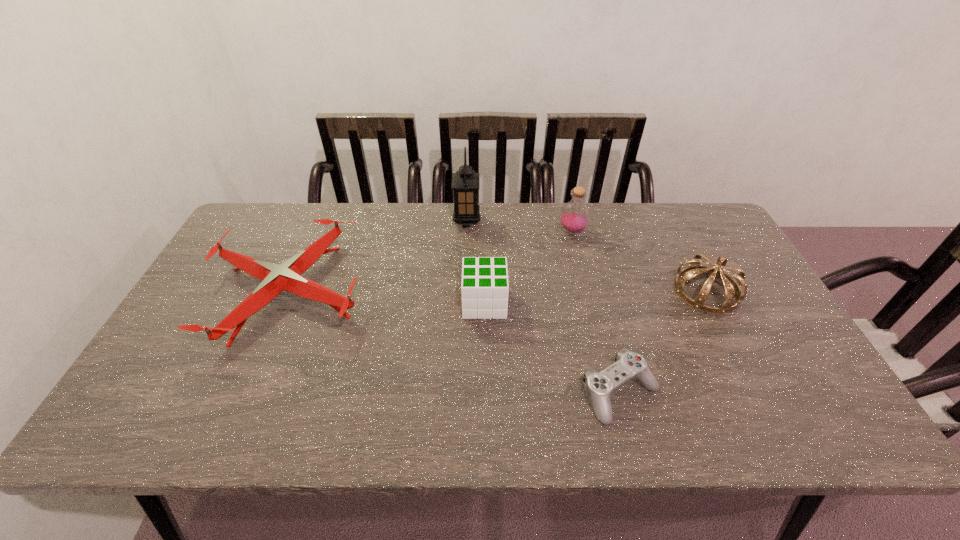
Identify the location of vacant region that satisfies the following two spatial constraints: 1. on the back side of the drone; 2. on the right side of the rightmost object. (289, 291).

The image size is (960, 540). What are the coordinates of `free spot that satisfies the following two spatial constraints: 1. on the front side of the tiara; 2. on the red face of the cube` in the screenshot? It's located at (712, 303).

Locate an element on the screen. free location that satisfies the following two spatial constraints: 1. on the front side of the tallest object; 2. on the left side of the fifth shortest object is located at coordinates (x=467, y=232).